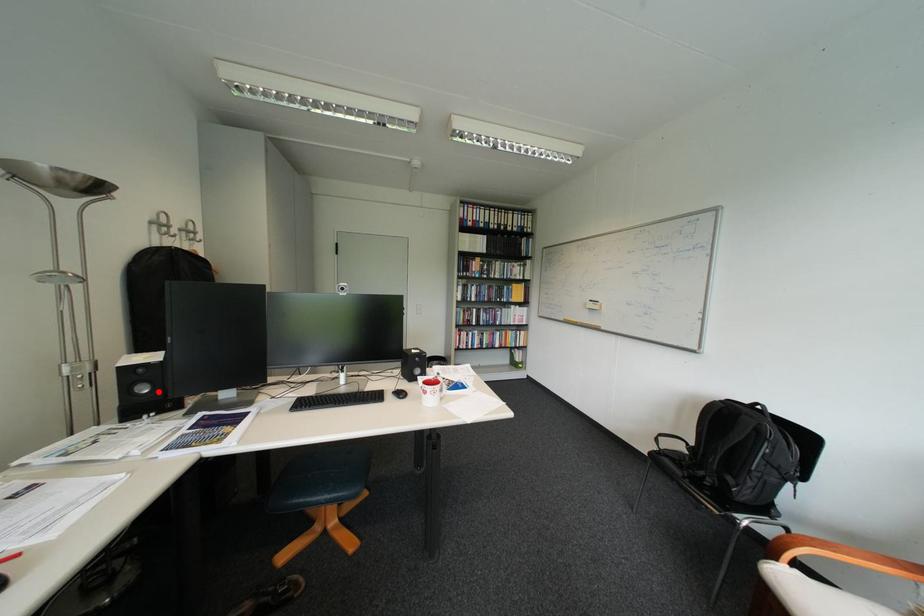
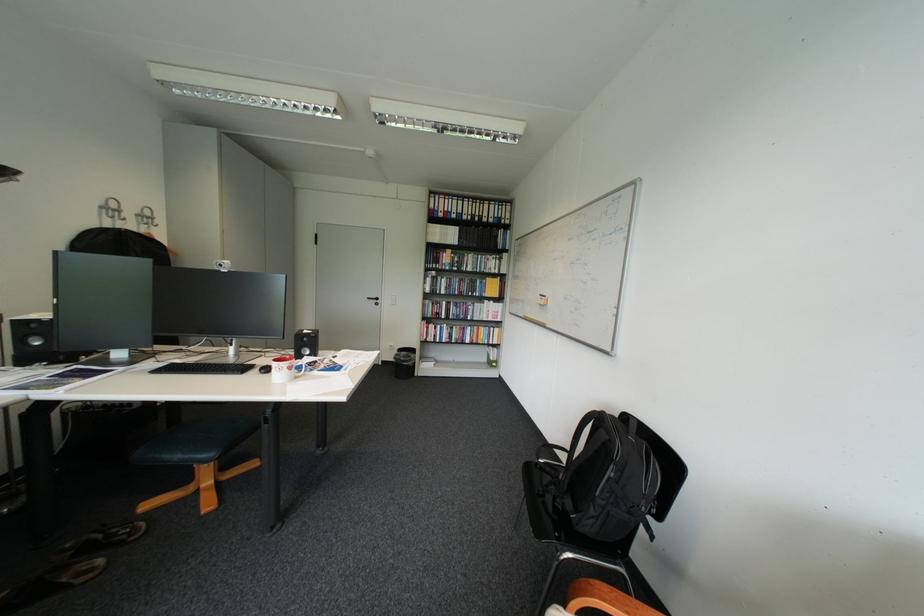
Question: I am providing you with two images of the same scene from different viewpoints. A red point is shown in image1. For the corresponding object point in image2, is it positioned nearer or farther from the camera?

Choices:
 (A) Nearer
 (B) Farther

Answer: (A)